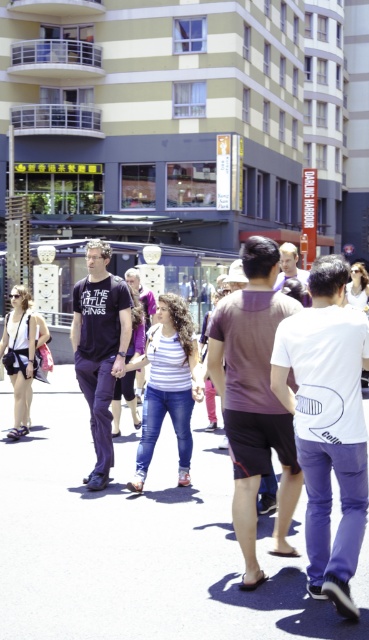
Question: Can you confirm if purple matte shorts at center is positioned to the right of matte black t-shirt at center?

Choices:
 (A) yes
 (B) no

Answer: (A)

Question: Is white concrete pavement at center thinner than striped cotton shirt at center?

Choices:
 (A) no
 (B) yes

Answer: (A)

Question: Which point is farther to the camera?

Choices:
 (A) striped cotton shirt at center
 (B) matte black t-shirt at center

Answer: (B)

Question: Is white matte shirt at center bigger than matte black t-shirt at center?

Choices:
 (A) yes
 (B) no

Answer: (B)

Question: Which point is closer to the camera taking this photo?

Choices:
 (A) (21, 413)
 (B) (95, 266)

Answer: (B)

Question: Which of the following is the farthest from the observer?

Choices:
 (A) click(28, 317)
 (B) click(267, 406)
 (C) click(176, 310)
 (D) click(108, 449)

Answer: (A)